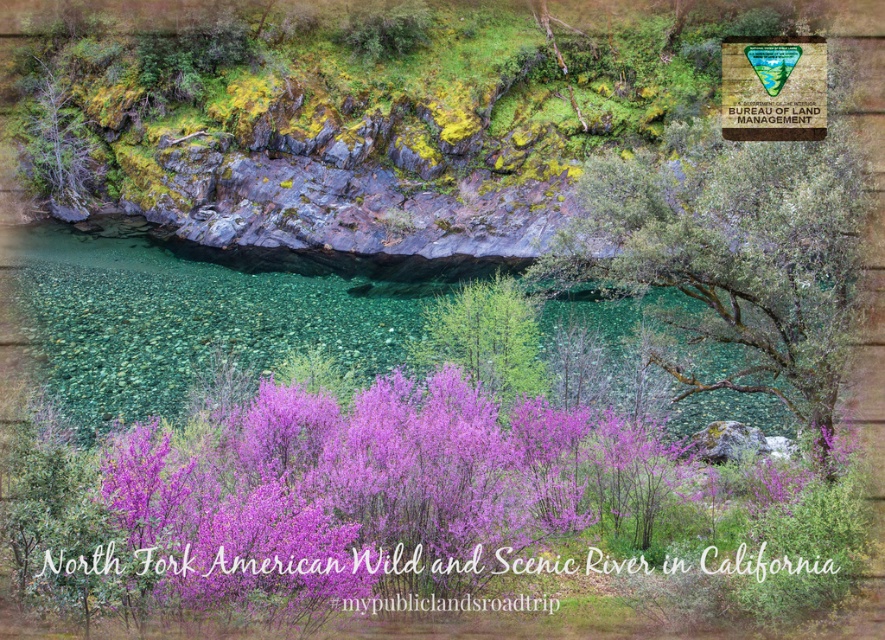
Can you confirm if purple bloom at center is positioned to the left of green leafy tree at center-right?

Correct, you'll find purple bloom at center to the left of green leafy tree at center-right.

Who is more distant from viewer, (319, 474) or (658, 221)?

Point (658, 221)

The image size is (885, 640). Identify the location of purple bloom at center. (363, 490).

Measure the distance between point (768, 310) and camera.

Point (768, 310) is 29.26 meters from camera.

Which of these two, green leafy tree at center-right or wooden sign at upper right, stands shorter?

Standing shorter between the two is wooden sign at upper right.

Image resolution: width=885 pixels, height=640 pixels. What are the coordinates of `green leafy tree at center-right` in the screenshot? It's located at (732, 256).

Is green leafy tree at center-right wider than purple leafy tree at center?

Yes.

Does green leafy tree at center-right have a larger size compared to purple leafy tree at center?

Yes.

The width and height of the screenshot is (885, 640). What are the coordinates of `green leafy tree at center-right` in the screenshot? It's located at (732, 256).